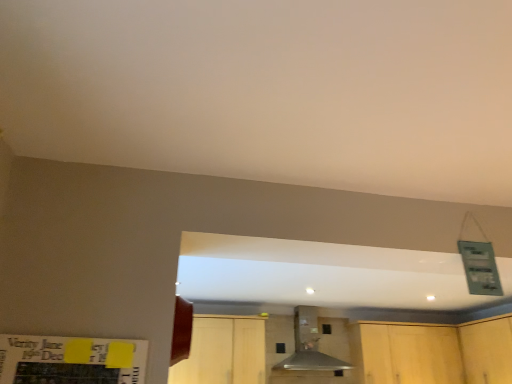
Question: Considering the relative sizes of metallic gray vent at center and light wood cabinetry at lower right, arranged as the 2th cabinetry when viewed from the left, in the image provided, is metallic gray vent at center shorter than light wood cabinetry at lower right, arranged as the 2th cabinetry when viewed from the left,?

Choices:
 (A) no
 (B) yes

Answer: (B)

Question: Is metallic gray vent at center smaller than light wood cabinetry at lower right, the second cabinetry viewed from the right?

Choices:
 (A) yes
 (B) no

Answer: (A)

Question: Is the depth of metallic gray vent at center less than that of light wood cabinetry at lower right, arranged as the 2th cabinetry when viewed from the left?

Choices:
 (A) no
 (B) yes

Answer: (B)

Question: From the image's perspective, is metallic gray vent at center above light wood cabinetry at lower right, the second cabinetry viewed from the right?

Choices:
 (A) no
 (B) yes

Answer: (B)

Question: Considering the relative sizes of metallic gray vent at center and light wood cabinetry at lower right, the second cabinetry viewed from the right, in the image provided, is metallic gray vent at center thinner than light wood cabinetry at lower right, the second cabinetry viewed from the right,?

Choices:
 (A) no
 (B) yes

Answer: (A)

Question: Can you confirm if metallic gray vent at center is bigger than light wood cabinetry at lower right, arranged as the 2th cabinetry when viewed from the left?

Choices:
 (A) yes
 (B) no

Answer: (B)

Question: Does wooden cabinet at lower right, which ranks as the 3th cabinetry in left-to-right order, contain light wood cabinetry at lower right, arranged as the 2th cabinetry when viewed from the left?

Choices:
 (A) no
 (B) yes

Answer: (A)

Question: Is wooden cabinet at lower right, the 1th cabinetry in the right-to-left sequence, taller than light wood cabinetry at lower right, the second cabinetry viewed from the right?

Choices:
 (A) yes
 (B) no

Answer: (B)

Question: Is wooden cabinet at lower right, the 1th cabinetry in the right-to-left sequence, looking in the opposite direction of light wood cabinetry at lower right, the second cabinetry viewed from the right?

Choices:
 (A) no
 (B) yes

Answer: (A)

Question: Is wooden cabinet at lower right, the 1th cabinetry in the right-to-left sequence, directly adjacent to light wood cabinetry at lower right, arranged as the 2th cabinetry when viewed from the left?

Choices:
 (A) yes
 (B) no

Answer: (B)

Question: Is the depth of wooden cabinet at lower right, the 1th cabinetry in the right-to-left sequence, less than that of light wood cabinetry at lower right, the second cabinetry viewed from the right?

Choices:
 (A) yes
 (B) no

Answer: (A)

Question: Considering the relative sizes of wooden cabinet at lower right, the 1th cabinetry in the right-to-left sequence, and light wood cabinetry at lower right, the second cabinetry viewed from the right, in the image provided, is wooden cabinet at lower right, the 1th cabinetry in the right-to-left sequence, bigger than light wood cabinetry at lower right, the second cabinetry viewed from the right,?

Choices:
 (A) no
 (B) yes

Answer: (A)

Question: Is light wood cabinet at lower center, which ranks as the 3th cabinetry in right-to-left order, facing towards wooden cabinet at lower right, the 1th cabinetry in the right-to-left sequence?

Choices:
 (A) no
 (B) yes

Answer: (A)